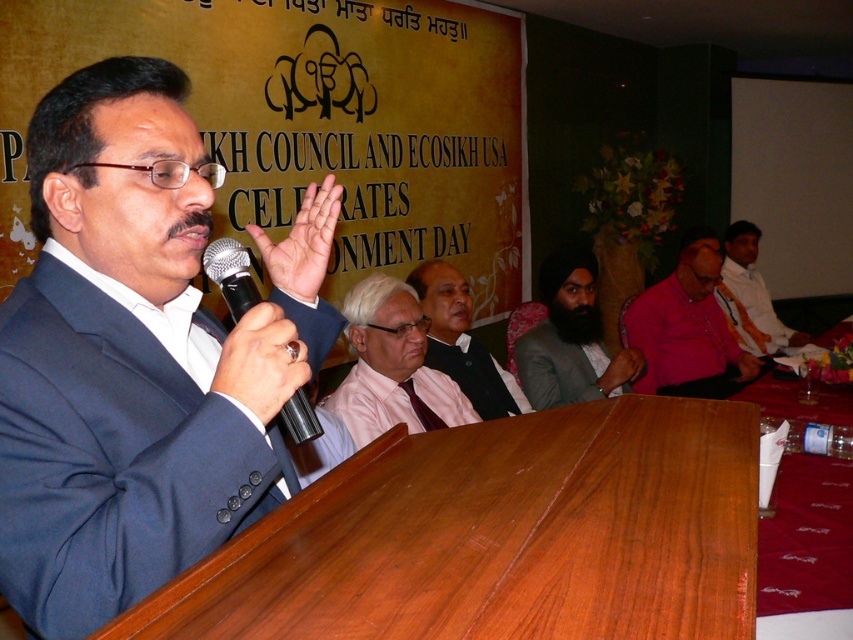
Consider the image. You are an event planner who needs to place a decorative stand between the black metallic microphone at center and the matte black wristband at lower center. Which object should the stand be placed closer to if it needs to be closer to the taller object?

The stand should be placed closer to the black metallic microphone at center because it is taller than the matte black wristband at lower center.

You are an event photographer at the Sikh Council and EcoSikh USA Environment Day event. You need to capture a closeup shot of the speaker. The speaker has his hand raised with his matte skin palm at center and is holding a black metallic microphone at center. Which object should you focus on to ensure the palm is in focus while the microphone is slightly blurred?

Since the matte skin palm at center is smaller than the black metallic microphone at center, focusing on the palm will keep it sharp while the larger microphone may appear slightly blurred due to the difference in size.

You are an attendee at this event and want to describe the speaker. Which object is covering the other between the dark brown turban at center and the matte black wristband at lower center?

The dark brown turban at center is positioned over the matte black wristband at lower center, so the dark brown turban at center covers the matte black wristband at lower center.